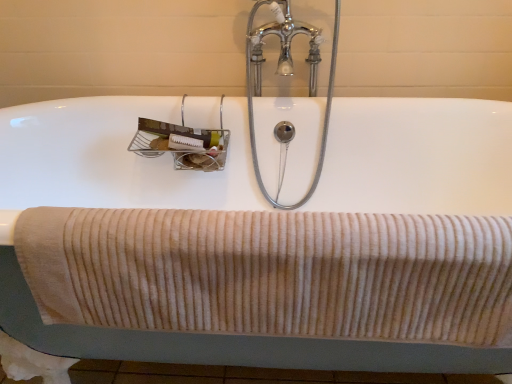
Where is `white ceramic bath at center`? This screenshot has width=512, height=384. white ceramic bath at center is located at coordinates (112, 160).

Describe the element at coordinates (286, 74) in the screenshot. I see `chrome/metallic faucet at upper center` at that location.

Find the location of a particular element. This screenshot has width=512, height=384. white ceramic bath at center is located at coordinates (112, 160).

Which is in front, point (280, 1) or point (479, 294)?

The point (479, 294) is in front.

In the image, is chrome/metallic faucet at upper center on the left side or the right side of beige corduroy towel at lower center?

chrome/metallic faucet at upper center is to the right of beige corduroy towel at lower center.

Could you tell me if chrome/metallic faucet at upper center is facing beige corduroy towel at lower center?

Yes, chrome/metallic faucet at upper center is facing beige corduroy towel at lower center.

Does chrome/metallic faucet at upper center lie in front of beige corduroy towel at lower center?

No, chrome/metallic faucet at upper center is further to the viewer.

Does white ceramic bath at center have a greater height compared to beige corduroy towel at lower center?

Correct, white ceramic bath at center is much taller as beige corduroy towel at lower center.

From the image's perspective, which one is positioned lower, white ceramic bath at center or beige corduroy towel at lower center?

white ceramic bath at center, from the image's perspective.

Find the location of a particular element. The image size is (512, 384). bath that appears below the beige corduroy towel at lower center (from a real-world perspective) is located at coordinates (112, 160).

Can you confirm if white ceramic bath at center is positioned to the right of beige corduroy towel at lower center?

No, white ceramic bath at center is not to the right of beige corduroy towel at lower center.

In the scene shown: Which of these two, beige corduroy towel at lower center or chrome/metallic faucet at upper center, is wider?

With larger width is chrome/metallic faucet at upper center.

Considering the positions of objects beige corduroy towel at lower center and chrome/metallic faucet at upper center in the image provided, who is more to the right, beige corduroy towel at lower center or chrome/metallic faucet at upper center?

From the viewer's perspective, chrome/metallic faucet at upper center appears more on the right side.

Locate an element on the screen. The width and height of the screenshot is (512, 384). bath towel on the left of chrome/metallic faucet at upper center is located at coordinates (273, 273).

Considering the relative sizes of beige corduroy towel at lower center and chrome/metallic faucet at upper center in the image provided, is beige corduroy towel at lower center smaller than chrome/metallic faucet at upper center?

Yes, beige corduroy towel at lower center is smaller than chrome/metallic faucet at upper center.

Between chrome/metallic faucet at upper center and white ceramic bath at center, which one is positioned behind?

chrome/metallic faucet at upper center is further away from the camera.

From a real-world perspective, between chrome/metallic faucet at upper center and white ceramic bath at center, who is vertically lower?

From a 3D spatial view, white ceramic bath at center is below.

Is chrome/metallic faucet at upper center next to white ceramic bath at center?

No, chrome/metallic faucet at upper center is not beside white ceramic bath at center.

Does chrome/metallic faucet at upper center have a smaller size compared to white ceramic bath at center?

Indeed, chrome/metallic faucet at upper center has a smaller size compared to white ceramic bath at center.

Does white ceramic bath at center have a greater width compared to chrome/metallic faucet at upper center?

Correct, the width of white ceramic bath at center exceeds that of chrome/metallic faucet at upper center.

From the image's perspective, is white ceramic bath at center positioned above or below chrome/metallic faucet at upper center?

white ceramic bath at center is situated lower than chrome/metallic faucet at upper center in the image.

Based on the photo, between white ceramic bath at center and chrome/metallic faucet at upper center, which one has more height?

white ceramic bath at center is taller.

Based on their sizes in the image, would you say white ceramic bath at center is bigger or smaller than chrome/metallic faucet at upper center?

Considering their sizes, white ceramic bath at center takes up more space than chrome/metallic faucet at upper center.

Identify the location of bath below the beige corduroy towel at lower center (from the image's perspective). This screenshot has height=384, width=512. (112, 160).

Consider the image. From the image's perspective, which one is positioned lower, beige corduroy towel at lower center or white ceramic bath at center?

white ceramic bath at center.

From a real-world perspective, which is physically below, beige corduroy towel at lower center or white ceramic bath at center?

white ceramic bath at center is physically lower.

Between beige corduroy towel at lower center and white ceramic bath at center, which one appears on the right side from the viewer's perspective?

beige corduroy towel at lower center.

Where is `tap lying behind the beige corduroy towel at lower center`? This screenshot has height=384, width=512. tap lying behind the beige corduroy towel at lower center is located at coordinates (286, 74).

The height and width of the screenshot is (384, 512). Find the location of `bath towel above the white ceramic bath at center (from a real-world perspective)`. bath towel above the white ceramic bath at center (from a real-world perspective) is located at coordinates (273, 273).

From the image, which object appears to be nearer to white ceramic bath at center, beige corduroy towel at lower center or chrome/metallic faucet at upper center?

Based on the image, chrome/metallic faucet at upper center appears to be nearer to white ceramic bath at center.

Estimate the real-world distances between objects in this image. Which object is further from chrome/metallic faucet at upper center, white ceramic bath at center or beige corduroy towel at lower center?

beige corduroy towel at lower center.

Based on their spatial positions, is beige corduroy towel at lower center or white ceramic bath at center further from chrome/metallic faucet at upper center?

The object further to chrome/metallic faucet at upper center is beige corduroy towel at lower center.

When comparing their distances from beige corduroy towel at lower center, does chrome/metallic faucet at upper center or white ceramic bath at center seem closer?

The object closer to beige corduroy towel at lower center is white ceramic bath at center.

Based on their spatial positions, is chrome/metallic faucet at upper center or beige corduroy towel at lower center closer to white ceramic bath at center?

chrome/metallic faucet at upper center.

Estimate the real-world distances between objects in this image. Which object is further from beige corduroy towel at lower center, white ceramic bath at center or chrome/metallic faucet at upper center?

chrome/metallic faucet at upper center.

In order to click on bath positioned between beige corduroy towel at lower center and chrome/metallic faucet at upper center from near to far in this screenshot , I will do `click(112, 160)`.